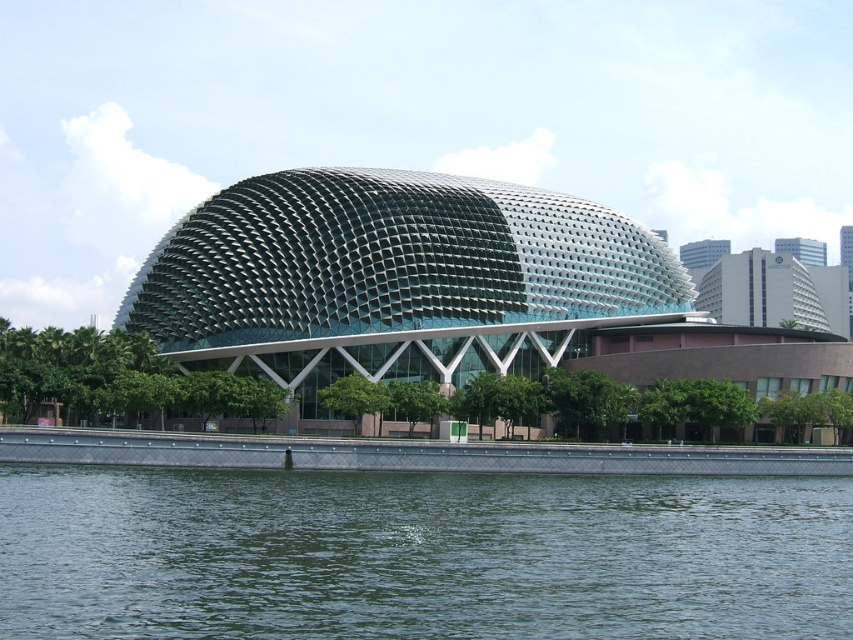
Question: Can you confirm if green water at lower center is positioned above green textured dome at center?

Choices:
 (A) no
 (B) yes

Answer: (A)

Question: Is green water at lower center below green textured dome at center?

Choices:
 (A) no
 (B) yes

Answer: (B)

Question: Which point is closer to the camera?

Choices:
 (A) green water at lower center
 (B) green textured dome at center

Answer: (A)

Question: Is green water at lower center to the right of green textured dome at center from the viewer's perspective?

Choices:
 (A) no
 (B) yes

Answer: (A)